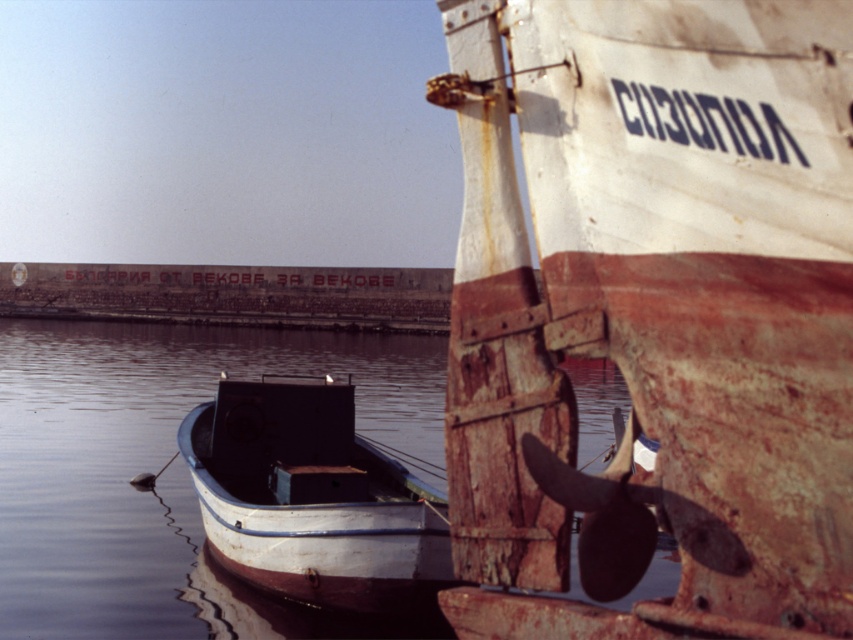
Describe the element at coordinates (654, 310) in the screenshot. I see `rusty wood boat at center` at that location.

Can you confirm if rusty wood boat at center is wider than rusty metal boat at center?

In fact, rusty wood boat at center might be narrower than rusty metal boat at center.

Is point (822, 584) positioned before point (271, 387)?

Yes, it is.

Identify the location of rusty wood boat at center. (654, 310).

Can you confirm if rusty wood boat at center is positioned above smooth water at center?

No.

Which is in front, point (814, 342) or point (91, 595)?

Positioned in front is point (814, 342).

Locate an element on the screen. rusty wood boat at center is located at coordinates (654, 310).

Identify the location of smooth water at center. Image resolution: width=853 pixels, height=640 pixels. (164, 472).

What do you see at coordinates (164, 472) in the screenshot?
I see `smooth water at center` at bounding box center [164, 472].

The width and height of the screenshot is (853, 640). Identify the location of smooth water at center. (164, 472).